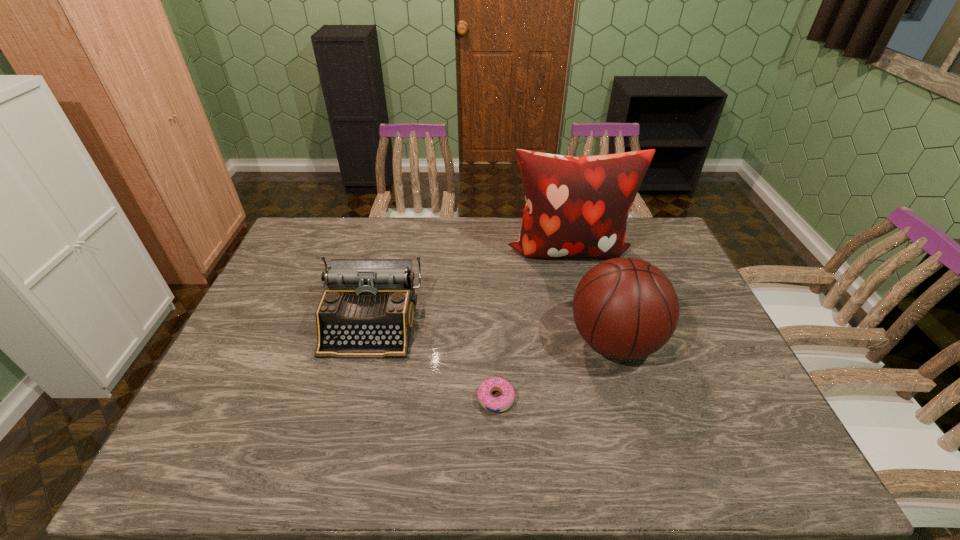
Where is `free space at the far right corner of the desktop`? The height and width of the screenshot is (540, 960). free space at the far right corner of the desktop is located at coordinates (633, 252).

Locate an element on the screen. The width and height of the screenshot is (960, 540). empty space between the tallest object and the third object from right to left is located at coordinates (532, 324).

At what (x,y) coordinates should I click in order to perform the action: click on empty space that is in between the leftmost object and the second object from left to right. Please return your answer as a coordinate pair (x, y). The image size is (960, 540). Looking at the image, I should click on (433, 361).

Find the location of `unoccupied position between the nearest object and the basketball`. unoccupied position between the nearest object and the basketball is located at coordinates (555, 370).

This screenshot has height=540, width=960. In order to click on vacant area that lies between the typewriter and the doughnut in this screenshot , I will do `click(433, 361)`.

Image resolution: width=960 pixels, height=540 pixels. Identify the location of empty space that is in between the basketball and the third object from right to left. (555, 370).

At what (x,y) coordinates should I click in order to perform the action: click on empty location between the third object from right to left and the second tallest object. Please return your answer as a coordinate pair (x, y). Image resolution: width=960 pixels, height=540 pixels. Looking at the image, I should click on (555, 370).

You are a GUI agent. You are given a task and a screenshot of the screen. Output one action in this format:
    pyautogui.click(x=<x>, y=<y>)
    Task: Click on the free spot between the shortest object and the typewriter
    The image size is (960, 540).
    Given the screenshot: What is the action you would take?
    pyautogui.click(x=433, y=361)

This screenshot has width=960, height=540. I want to click on vacant space in between the doughnut and the cushion, so click(x=532, y=324).

Identify the location of free space between the third shortest object and the third object from right to left. (555, 370).